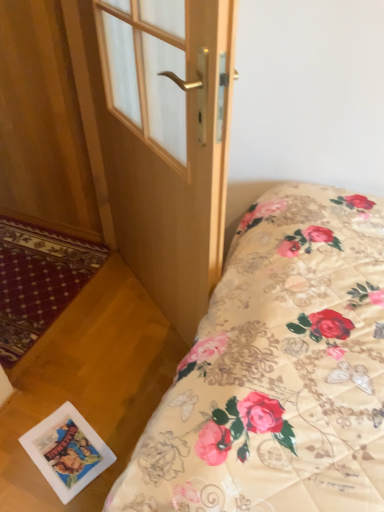
Find the location of a particular element. The image size is (384, 512). vacant area in front of wooden door at center is located at coordinates (110, 386).